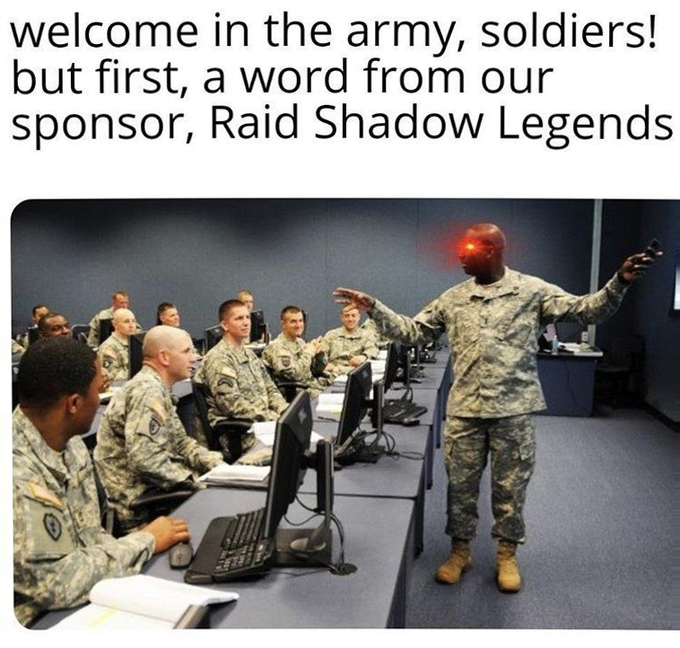
Where is `computer monitors`? This screenshot has height=648, width=680. computer monitors is located at coordinates (285, 476), (355, 395), (396, 358).